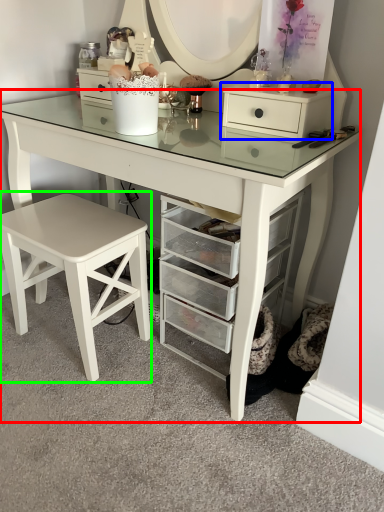
Question: Which object is the closest to the table (highlighted by a red box)? Choose among these: chest of drawers (highlighted by a blue box) or stool (highlighted by a green box).

Choices:
 (A) chest of drawers
 (B) stool

Answer: (A)